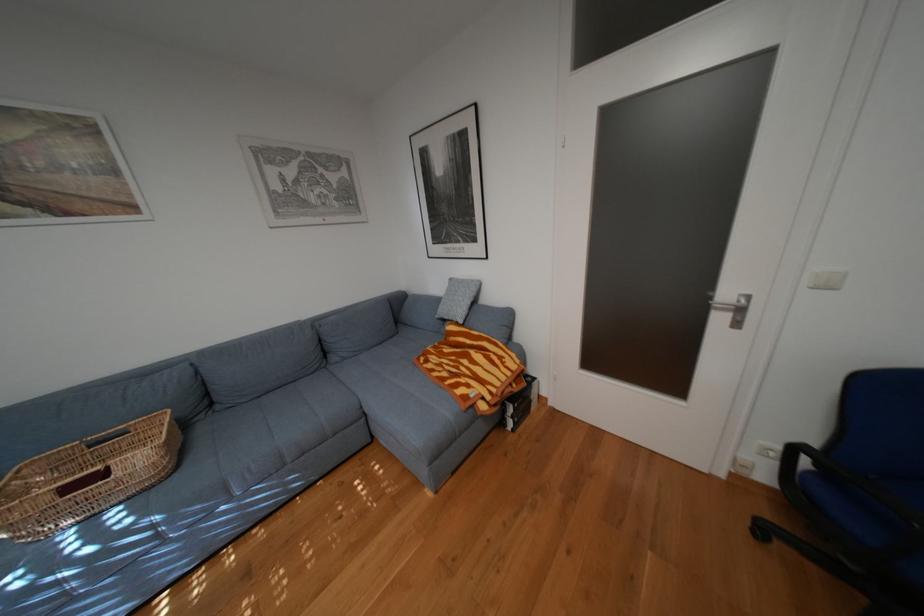
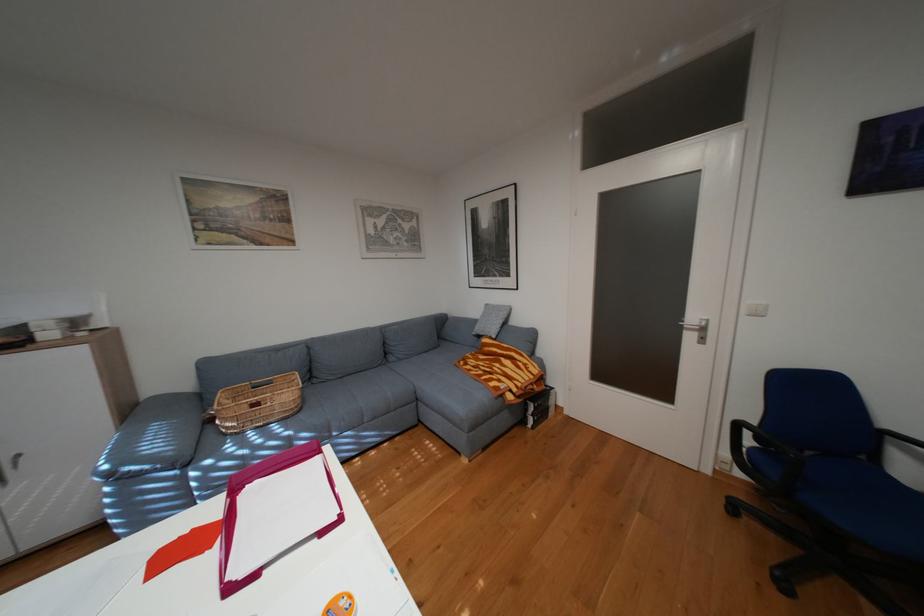
Question: How did the camera likely rotate?

Choices:
 (A) Left
 (B) Right
 (C) Up
 (D) Down

Answer: (C)